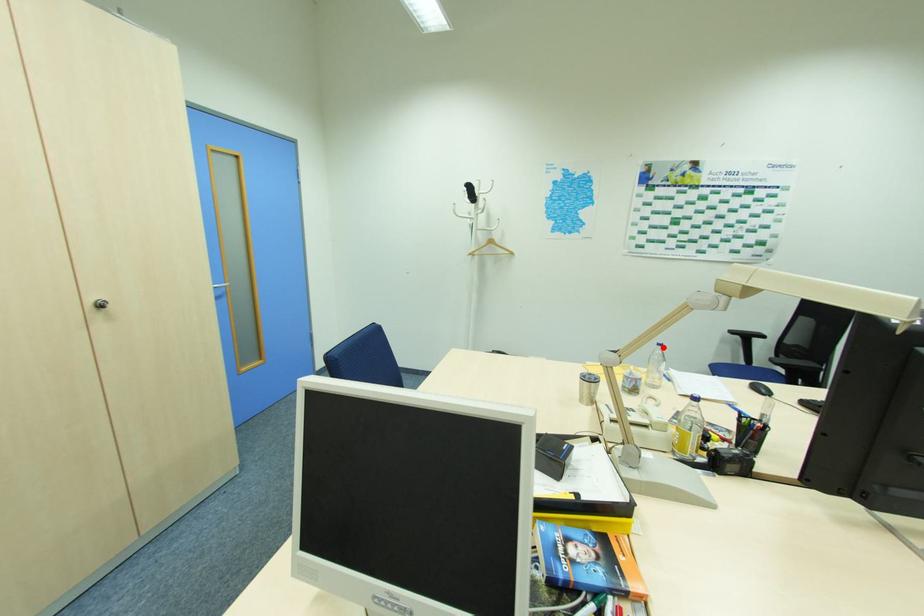
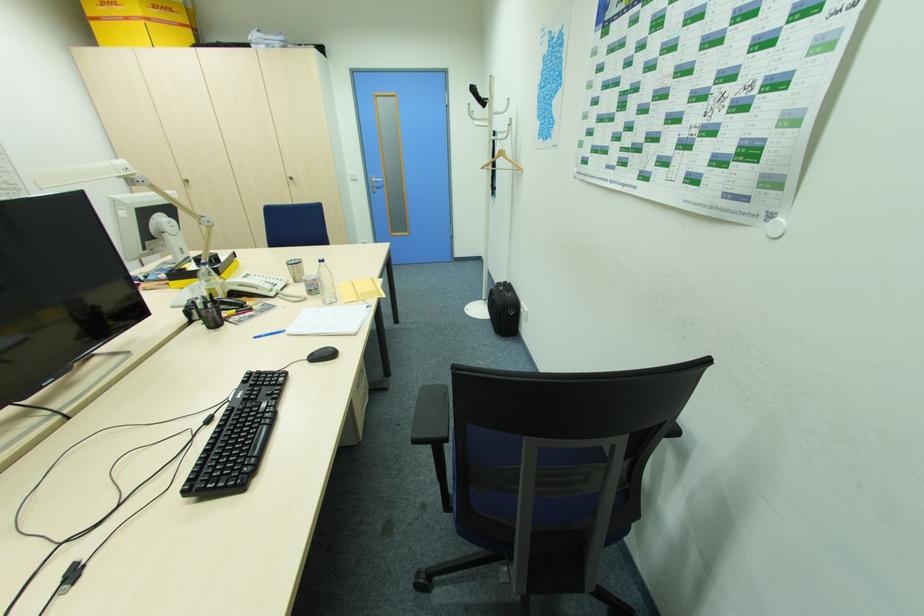
Question: A red point is marked in image1. In image2, is the corresponding 3D point closer to the camera or farther? Reply with the corresponding letter.

Choices:
 (A) The corresponding 3D point is closer.
 (B) The corresponding 3D point is farther.

Answer: (A)